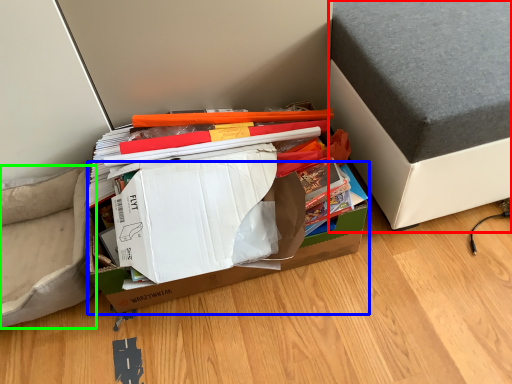
Question: Which object is the farthest from furniture (highlighted by a red box)? Choose among these: cardboard box (highlighted by a blue box) or armchair (highlighted by a green box).

Choices:
 (A) cardboard box
 (B) armchair

Answer: (B)